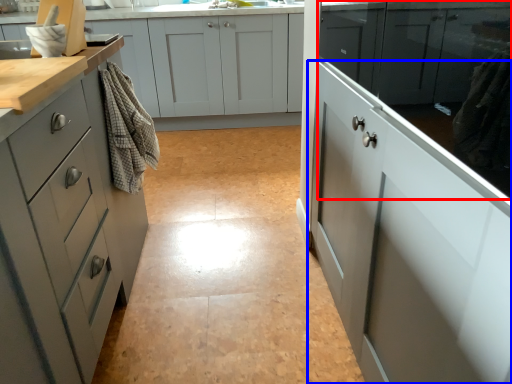
Question: Which of the following is the farthest to the observer, cabinetry (highlighted by a red box) or cabinetry (highlighted by a blue box)?

Choices:
 (A) cabinetry
 (B) cabinetry

Answer: (B)